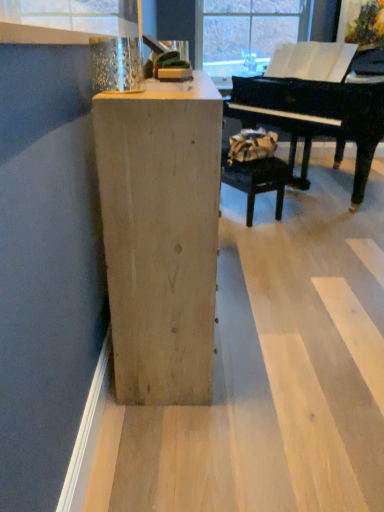
Question: From a real-world perspective, relative to black polished piano at upper right, is natural wood cabinet at center vertically above or below?

Choices:
 (A) below
 (B) above

Answer: (A)

Question: Does point (206, 364) appear closer or farther from the camera than point (291, 117)?

Choices:
 (A) farther
 (B) closer

Answer: (B)

Question: Which object is the farthest from the black polished piano at upper right?

Choices:
 (A) metallic glass at upper left
 (B) leather-like brown bag at center
 (C) natural wood cabinet at center

Answer: (C)

Question: Which object is the farthest from the natural wood cabinet at center?

Choices:
 (A) metallic glass at upper left
 (B) leather-like brown bag at center
 (C) black polished piano at upper right

Answer: (C)